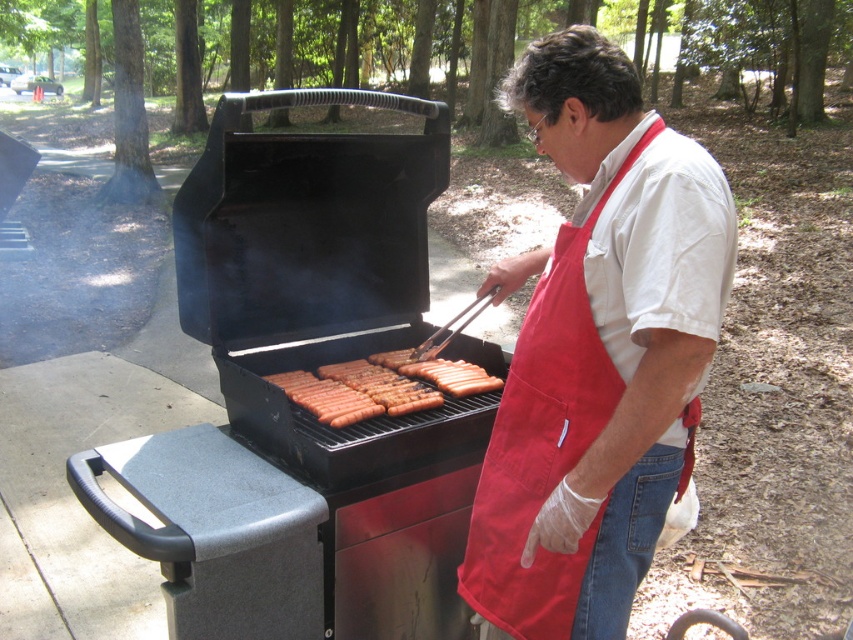
Is white cotton shirt at center below brown matte hot dog at center?

Actually, white cotton shirt at center is above brown matte hot dog at center.

Is white cotton shirt at center positioned behind brown matte hot dog at center?

No, it is not.

This screenshot has height=640, width=853. Describe the element at coordinates (596, 353) in the screenshot. I see `white cotton shirt at center` at that location.

Locate an element on the screen. This screenshot has width=853, height=640. white cotton shirt at center is located at coordinates (596, 353).

This screenshot has width=853, height=640. Describe the element at coordinates (299, 403) in the screenshot. I see `black matte barbecue grill at center` at that location.

Can you confirm if black matte barbecue grill at center is positioned to the left of brown matte hot dog at center?

Yes, black matte barbecue grill at center is to the left of brown matte hot dog at center.

Where is `black matte barbecue grill at center`? The height and width of the screenshot is (640, 853). black matte barbecue grill at center is located at coordinates (299, 403).

Is black matte barbecue grill at center closer to camera compared to white cotton shirt at center?

No, black matte barbecue grill at center is behind white cotton shirt at center.

Is black matte barbecue grill at center above white cotton shirt at center?

No.

Is point (416, 276) closer to camera compared to point (549, 154)?

No, (416, 276) is behind (549, 154).

Identify the location of black matte barbecue grill at center. This screenshot has height=640, width=853. (299, 403).